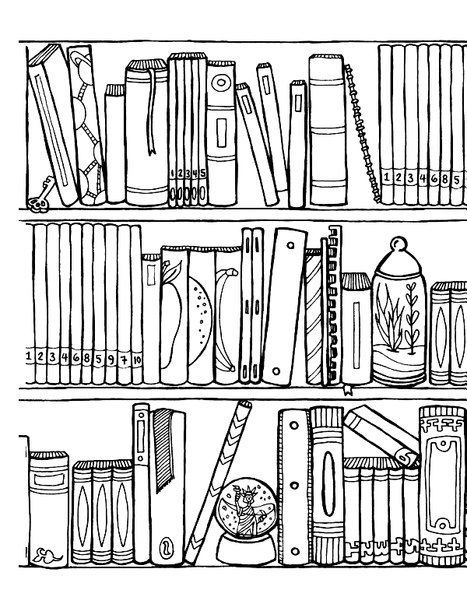
At what (x,y) coordinates should I click in order to perform the action: click on binders. Please return your answer as a coordinate pair (x, y). Looking at the image, I should click on (141, 493), (296, 498), (335, 310), (286, 307), (254, 294), (244, 294), (360, 133).